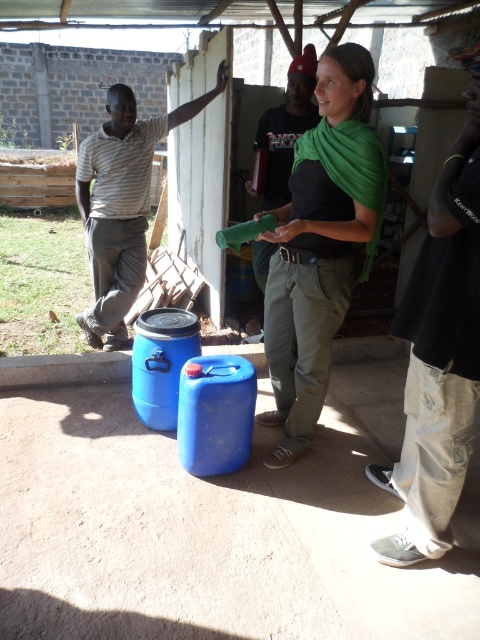
You are an observer standing in front of the scene. You see a person wearing a green matte scarf at center and a striped cotton shirt at left. Which clothing item is positioned lower on the person?

The green matte scarf at center is located below the striped cotton shirt at left, so the green matte scarf at center is positioned lower on the person.

You are organizing a clothing drive and need to stack the black cotton shirt at center and the striped cotton shirt at left vertically. Which shirt should you place at the bottom to ensure stability?

The black cotton shirt at center should be placed at the bottom because it has a lesser height compared to the striped cotton shirt at left, providing a stable base.

You are a tailor measuring the distance between two items in the scene. You have a measuring tape that can only measure up to 18 inches. Can you accurately measure the distance between the green matte scarf at center and the black cotton shirt at center using your tape?

The distance between the green matte scarf at center and the black cotton shirt at center is 19.28 inches, which exceeds the 18 inches limit of your measuring tape. Therefore, you cannot accurately measure the distance between them with your current tool.